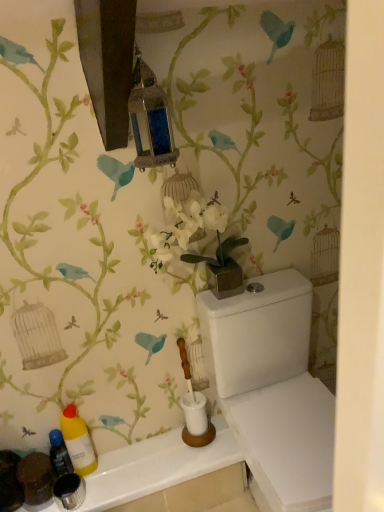
Where is `vacant area that is in front of yellow matte bottle at lower left, which is counted as the second bottle, starting from the left`? vacant area that is in front of yellow matte bottle at lower left, which is counted as the second bottle, starting from the left is located at coordinates (98, 490).